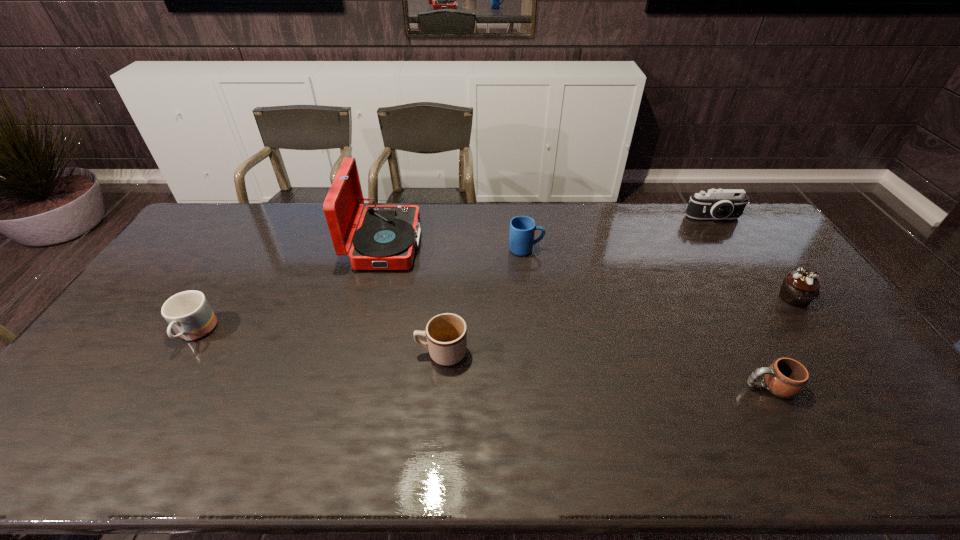
Image resolution: width=960 pixels, height=540 pixels. What are the coordinates of `free space located on the side of the shortest object with the handle` in the screenshot? It's located at (708, 387).

The width and height of the screenshot is (960, 540). What are the coordinates of `phonograph_record that is at the far edge` in the screenshot? It's located at (387, 235).

Locate an element on the screen. This screenshot has width=960, height=540. camera that is positioned at the far edge is located at coordinates (716, 203).

You are a GUI agent. You are given a task and a screenshot of the screen. Output one action in this format:
    pyautogui.click(x=<x>, y=<y>)
    Task: Click on the camera situated at the right edge
    The width and height of the screenshot is (960, 540).
    Given the screenshot: What is the action you would take?
    [716, 203]

Find the location of a particular element. cupcake that is at the right edge is located at coordinates (799, 288).

You are a GUI agent. You are given a task and a screenshot of the screen. Output one action in this format:
    pyautogui.click(x=<x>, y=<y>)
    Task: Click on the object at the far right corner
    Image resolution: width=960 pixels, height=540 pixels.
    Given the screenshot: What is the action you would take?
    pyautogui.click(x=716, y=203)

In the image, there is a desktop. Identify the location of vacant space at the far edge. This screenshot has height=540, width=960. (313, 234).

Identify the location of free spot at the near edge of the desktop. This screenshot has width=960, height=540. (583, 441).

In the image, there is a desktop. What are the coordinates of `vacant space at the left edge` in the screenshot? It's located at (167, 291).

The height and width of the screenshot is (540, 960). What are the coordinates of `vacant space at the right edge of the desktop` in the screenshot? It's located at (865, 408).